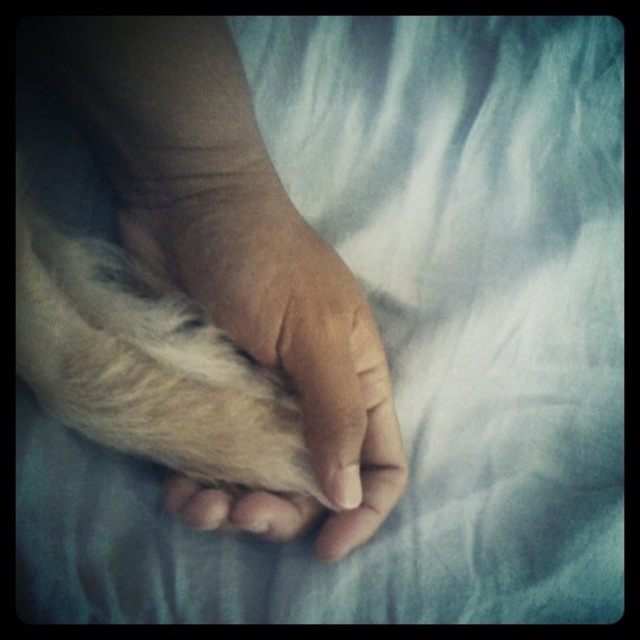
Measure the distance from dry skin paw at center to fuzzy white fur at center.

dry skin paw at center and fuzzy white fur at center are 2.10 inches apart.

Between dry skin paw at center and fuzzy white fur at center, which one has less height?

With less height is fuzzy white fur at center.

Which is behind, point (371, 376) or point (136, 376)?

The point (371, 376) is more distant.

Locate an element on the screen. The width and height of the screenshot is (640, 640). dry skin paw at center is located at coordinates (284, 324).